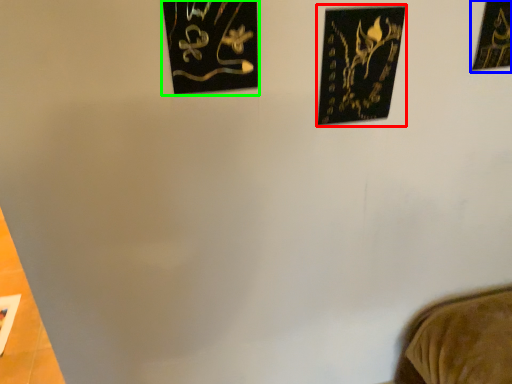
Question: Which is farther away from picture frame (highlighted by a red box)? picture frame (highlighted by a blue box) or picture frame (highlighted by a green box)?

Choices:
 (A) picture frame
 (B) picture frame

Answer: (A)